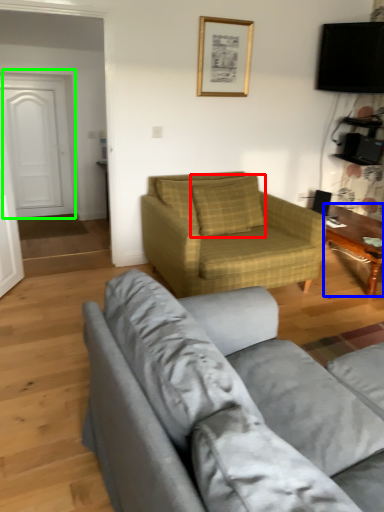
Question: Which is farther away from pillow (highlighted by a red box)? coffee table (highlighted by a blue box) or door (highlighted by a green box)?

Choices:
 (A) coffee table
 (B) door

Answer: (B)